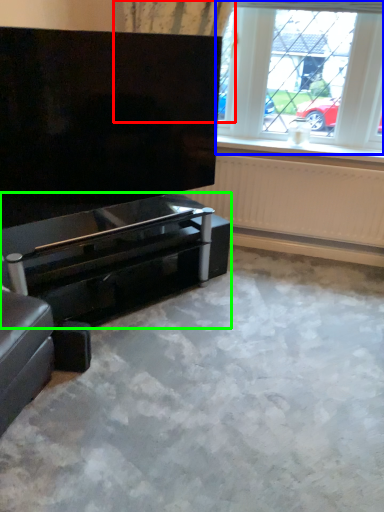
Question: Estimate the real-world distances between objects in this image. Which object is farther from curtain (highlighted by a red box), window (highlighted by a blue box) or piano (highlighted by a green box)?

Choices:
 (A) window
 (B) piano

Answer: (B)